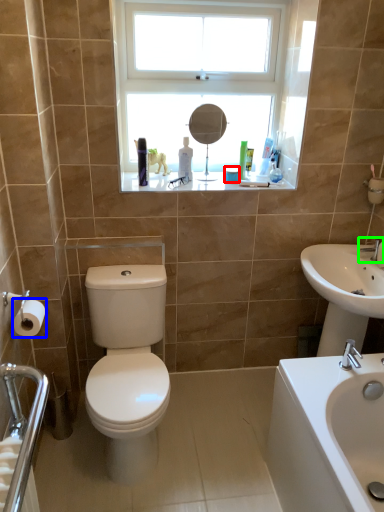
Question: Which object is the closest to the toiletry (highlighted by a red box)? Choose among these: toilet paper (highlighted by a blue box) or tap (highlighted by a green box).

Choices:
 (A) toilet paper
 (B) tap

Answer: (B)